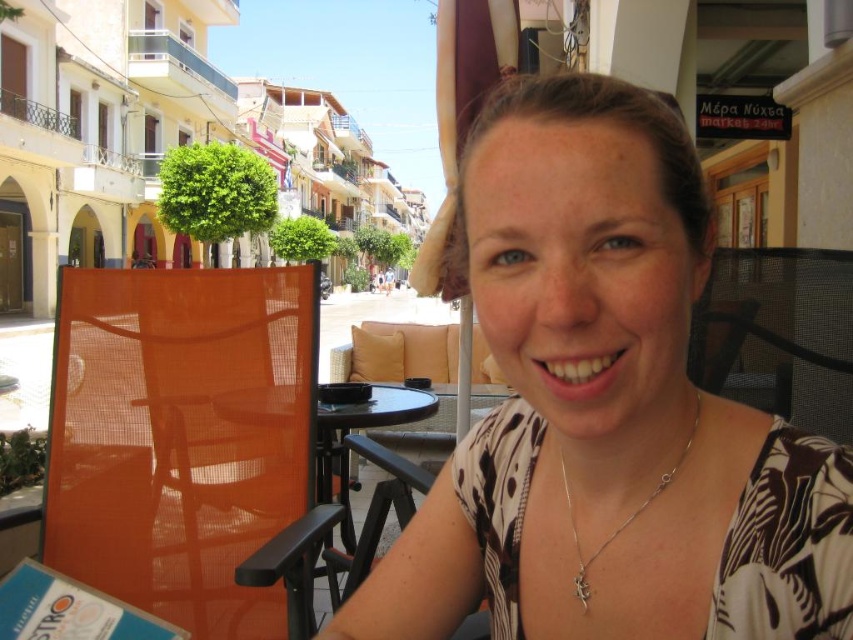
Can you confirm if white printed blouse at center is taller than black glass table at center?

Indeed, white printed blouse at center has a greater height compared to black glass table at center.

Is white printed blouse at center to the left of black glass table at center from the viewer's perspective?

In fact, white printed blouse at center is to the right of black glass table at center.

Based on the photo, who is more forward, (x=701, y=632) or (x=267, y=572)?

Point (x=701, y=632) is more forward.

The height and width of the screenshot is (640, 853). Identify the location of white printed blouse at center. pos(607,410).

Based on the photo, between orange mesh chair at left and silver/chain/necklace at center, which one is positioned lower?

orange mesh chair at left

Can you confirm if orange mesh chair at left is positioned above silver/chain/necklace at center?

Incorrect, orange mesh chair at left is not positioned above silver/chain/necklace at center.

Is point (125, 356) positioned before point (666, 486)?

No, it is behind (666, 486).

Where is `orange mesh chair at left`? orange mesh chair at left is located at coordinates (181, 436).

How distant is white printed blouse at center from silver/chain/necklace at center?

white printed blouse at center and silver/chain/necklace at center are 8.18 inches apart from each other.

Between white printed blouse at center and silver/chain/necklace at center, which one has more height?

white printed blouse at center

Is point (726, 529) positioned before point (572, 536)?

Yes, it is.

Locate an element on the screen. white printed blouse at center is located at coordinates (607, 410).